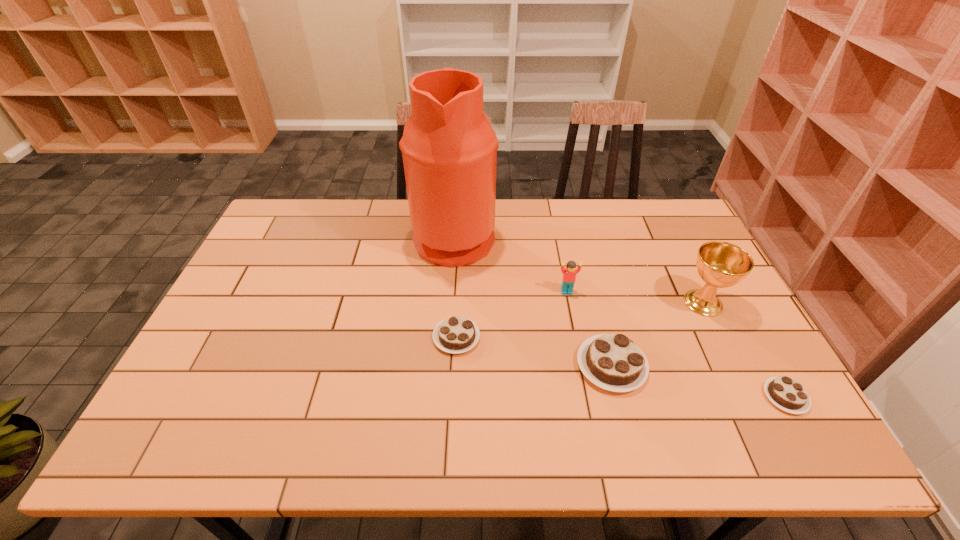
Please point a spot to add another chocolate cake on the left. Please provide its 2D coordinates. Your answer should be formatted as a tuple, i.e. [(x, y)], where the tuple contains the x and y coordinates of a point satisfying the conditions above.

[(318, 312)]